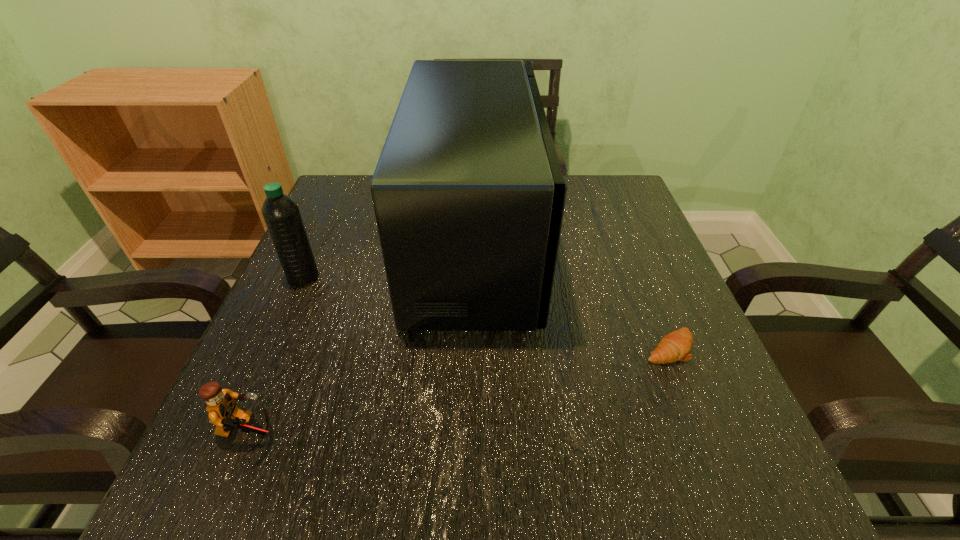
Locate an element on the screen. The image size is (960, 540). the tallest object is located at coordinates (468, 193).

The image size is (960, 540). Find the location of `microwave_oven`. microwave_oven is located at coordinates (468, 193).

The image size is (960, 540). Find the location of `water bottle`. water bottle is located at coordinates (281, 214).

Find the location of `the nearest object`. the nearest object is located at coordinates (224, 413).

At what (x,y) coordinates should I click in order to perform the action: click on the third tallest object. Please return your answer as a coordinate pair (x, y). Looking at the image, I should click on (224, 413).

What are the coordinates of `the rightmost object` in the screenshot? It's located at (675, 346).

What are the coordinates of `crescent roll` in the screenshot? It's located at (675, 346).

Image resolution: width=960 pixels, height=540 pixels. I want to click on vacant region located on the front-facing side of the third object from left to right, so click(607, 240).

This screenshot has width=960, height=540. What are the coordinates of `vacant space located 0.320m on the front of the water bottle` in the screenshot? It's located at (234, 434).

Image resolution: width=960 pixels, height=540 pixels. I want to click on free space located holding a crossbow in the hands of the second shortest object, so click(x=503, y=432).